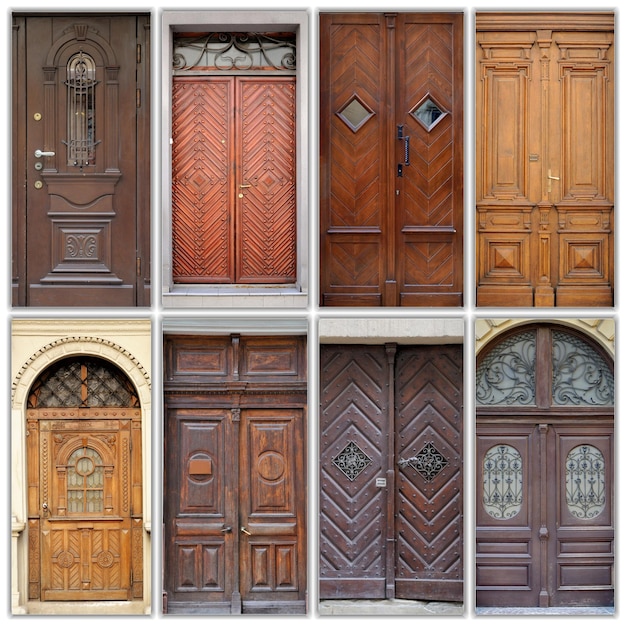
The height and width of the screenshot is (626, 626). In order to click on doors in this screenshot , I will do `click(95, 106)`, `click(205, 158)`, `click(423, 156)`, `click(558, 167)`, `click(552, 434)`, `click(398, 453)`, `click(210, 444)`, `click(105, 470)`.